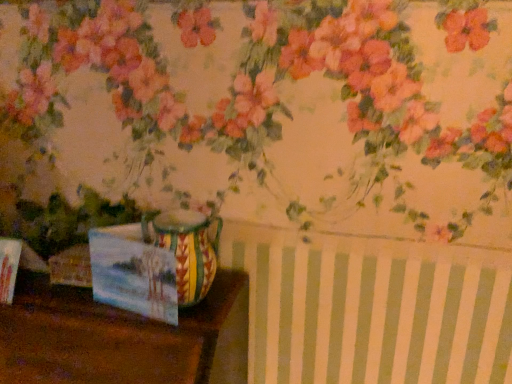
Find the location of `vacant area in front of multicolored ceramic vase at center`. vacant area in front of multicolored ceramic vase at center is located at coordinates (164, 334).